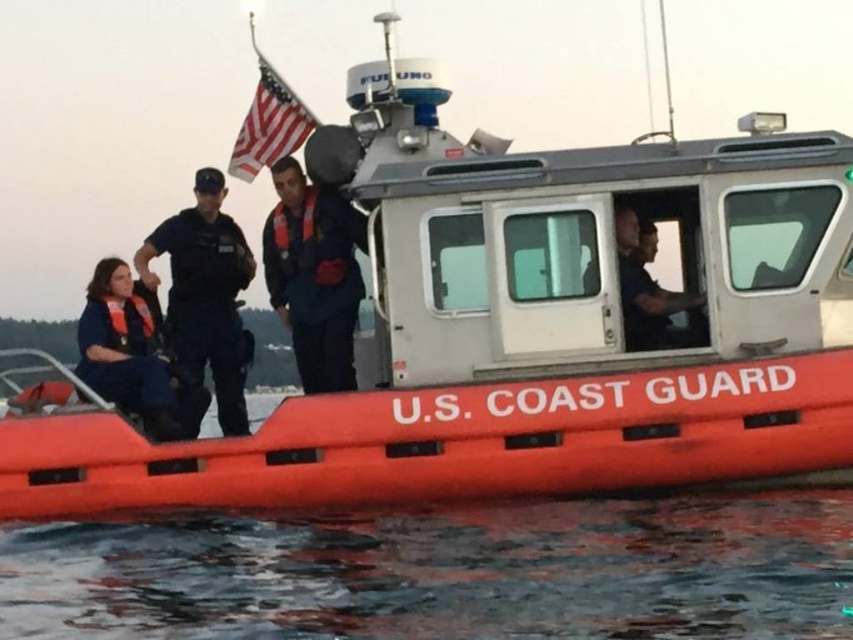
Can you confirm if matte black uniform at center is wider than matte orange life vest at left?

Correct, the width of matte black uniform at center exceeds that of matte orange life vest at left.

Does point (172, 346) come farther from viewer compared to point (149, 337)?

Yes, it is.

Locate an element on the screen. This screenshot has height=640, width=853. matte black uniform at center is located at coordinates (206, 294).

Which is in front, point (352, 584) or point (248, 136)?

Positioned in front is point (352, 584).

Does transparent water at lower center appear on the left side of american flag at upper center?

Incorrect, transparent water at lower center is not on the left side of american flag at upper center.

Does point (44, 528) lie behind point (270, 74)?

No, it is not.

The image size is (853, 640). In order to click on transparent water at lower center in this screenshot , I will do `click(445, 572)`.

Based on the photo, is matte orange life vest at left bigger than american flag at upper center?

Yes, matte orange life vest at left is bigger than american flag at upper center.

From the picture: Can you confirm if matte orange life vest at left is thinner than american flag at upper center?

Yes.

Is point (154, 422) more distant than point (283, 106)?

No, (154, 422) is closer to viewer.

Locate an element on the screen. The image size is (853, 640). matte orange life vest at left is located at coordinates (126, 349).